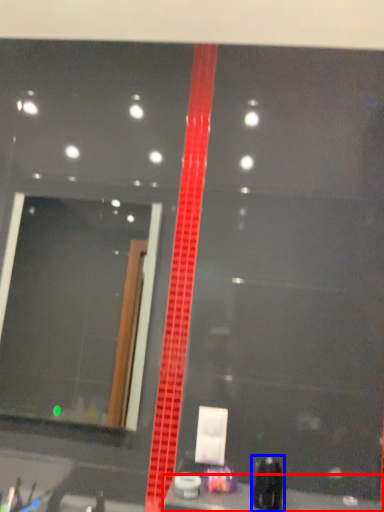
Question: Which point is further to the camera, counter top (highlighted by a red box) or toiletry (highlighted by a blue box)?

Choices:
 (A) counter top
 (B) toiletry

Answer: (B)